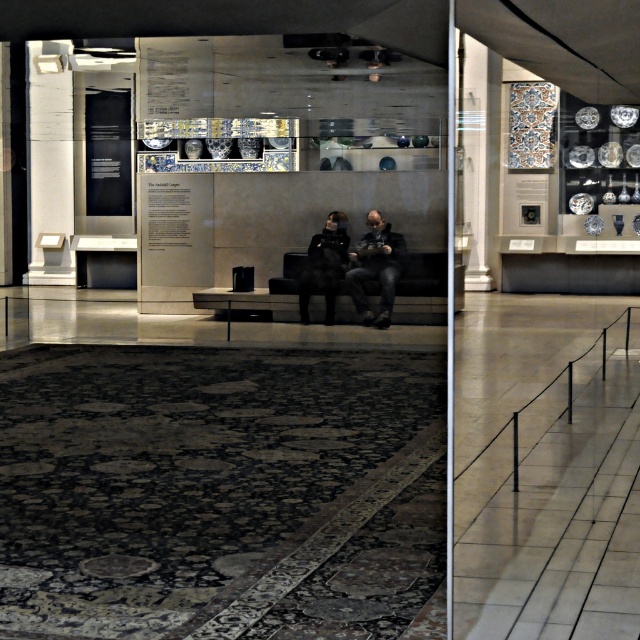
Question: Can you confirm if white marble pillar at left is positioned above black leather bench at center?

Choices:
 (A) yes
 (B) no

Answer: (A)

Question: Does white marble pillar at center have a smaller size compared to wooden pillar at center?

Choices:
 (A) yes
 (B) no

Answer: (B)

Question: Based on their relative distances, which object is nearer to the white marble pillar at left?

Choices:
 (A) wooden pillar at center
 (B) white marble pillar at center
 (C) black leather bench at center
 (D) dark gray fabric jacket at center

Answer: (A)

Question: Which is nearer to the dark gray fabric jacket at center?

Choices:
 (A) black leather bench at center
 (B) black leather jacket at center
 (C) white marble pillar at left
 (D) white marble pillar at center

Answer: (A)

Question: Which of these objects is positioned closest to the black leather jacket at center?

Choices:
 (A) white marble pillar at left
 (B) white marble pillar at center
 (C) dark gray fabric jacket at center

Answer: (C)

Question: Can you confirm if white marble pillar at center is positioned below dark gray fabric jacket at center?

Choices:
 (A) yes
 (B) no

Answer: (B)